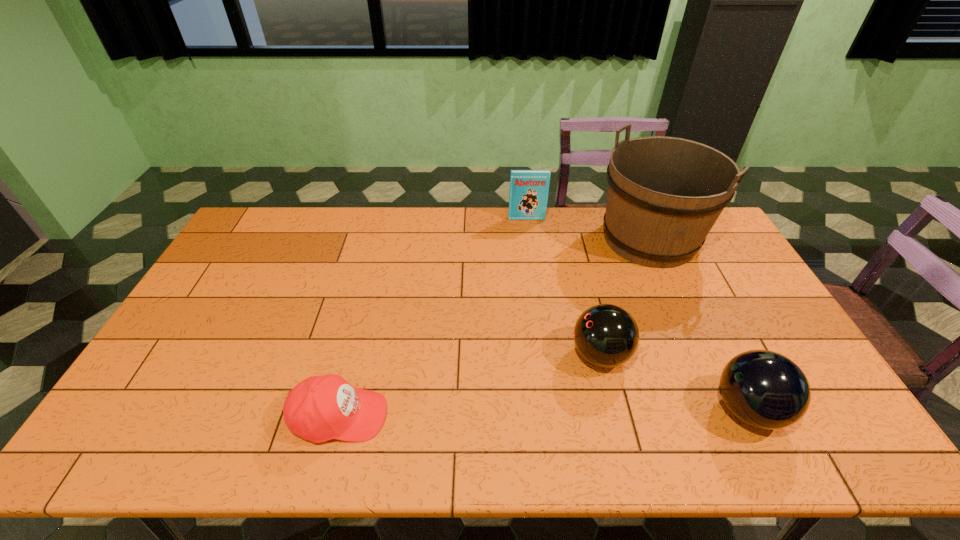
Identify the location of free spot that satisfies the following two spatial constraints: 1. on the front cover of the bucket; 2. on the left side of the second object from left to right. This screenshot has height=540, width=960. (529, 239).

You are a GUI agent. You are given a task and a screenshot of the screen. Output one action in this format:
    pyautogui.click(x=<x>, y=<y>)
    Task: Click on the vacant space that satisfies the following two spatial constraints: 1. on the front cover of the book; 2. on the right side of the tallest object
    The width and height of the screenshot is (960, 540).
    Given the screenshot: What is the action you would take?
    pyautogui.click(x=529, y=239)